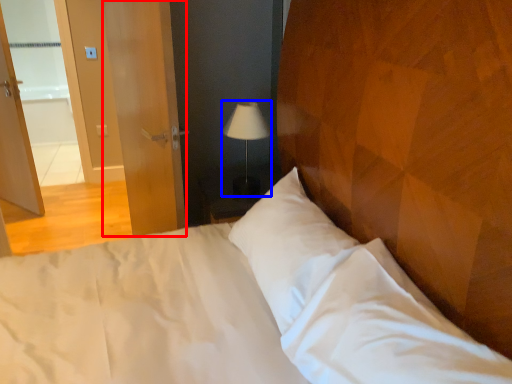
Question: Which point is closer to the camera, screen door (highlighted by a red box) or lamp (highlighted by a blue box)?

Choices:
 (A) screen door
 (B) lamp

Answer: (A)